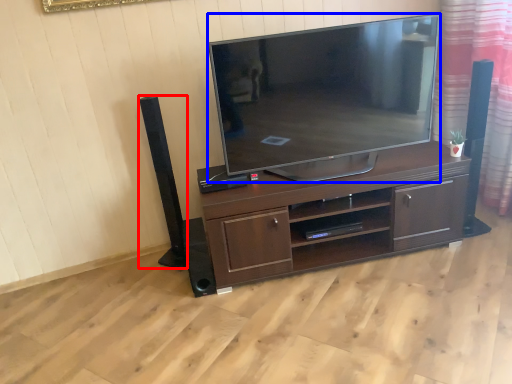
Question: Which of the following is the closest to the observer, speaker (highlighted by a red box) or television (highlighted by a blue box)?

Choices:
 (A) speaker
 (B) television

Answer: (B)